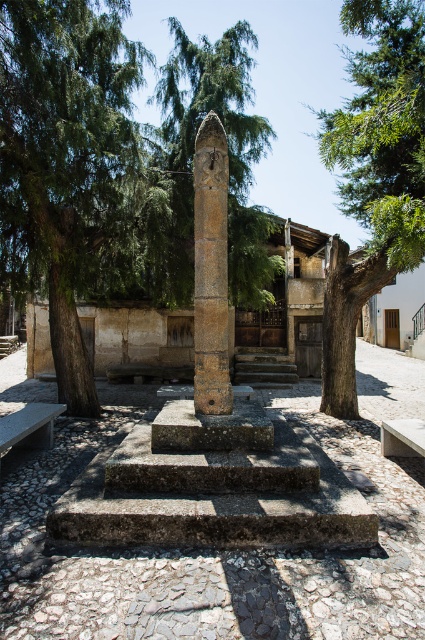
You are standing in the courtyard and want to take a photo of the brown stone column at center. The green leafy tree at right is blocking part of your view. Which direction should you move to get a clear shot of the column without the tree in the frame?

Since the green leafy tree at right is closer to the viewer than the brown stone column at center, moving to the left side of the courtyard would position you away from the tree, allowing you to see the brown stone column at center more clearly without obstruction.

You are standing in the courtyard and want to take a photo of the brown stone column at center without any obstruction from the green leafy tree at left. Based on their heights, is this possible?

The green leafy tree at left is taller than the brown stone column at center, so it might obstruct the view unless you position yourself where the tree is not in front of the column.

You are standing in the courtyard and want to take a photo of the brown stone column at center without any obstructions. Since the green leafy tree at left is in the way, which direction should you move to ensure the column is fully visible?

You should move to the right side of the green leafy tree at left so that the brown stone column at center is no longer blocked by the tree.